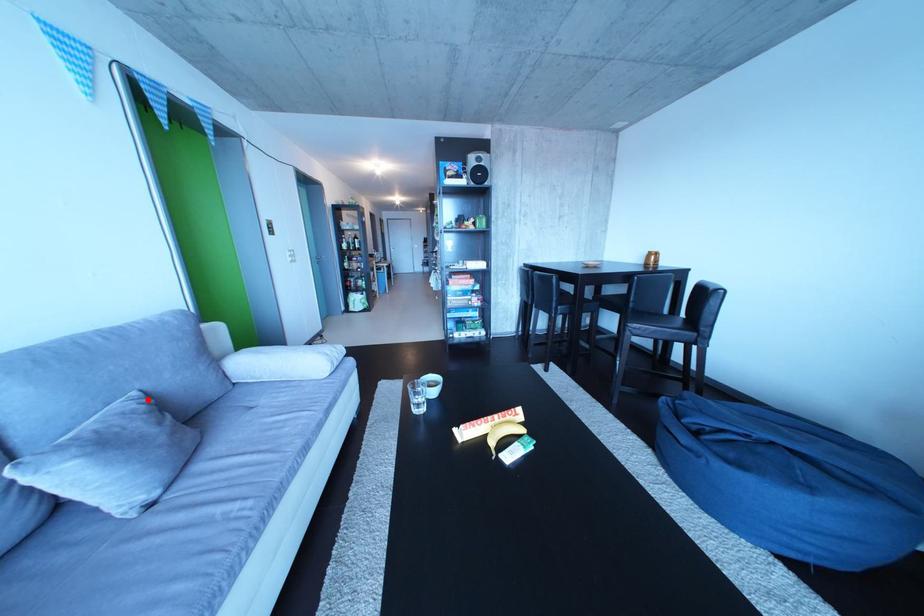
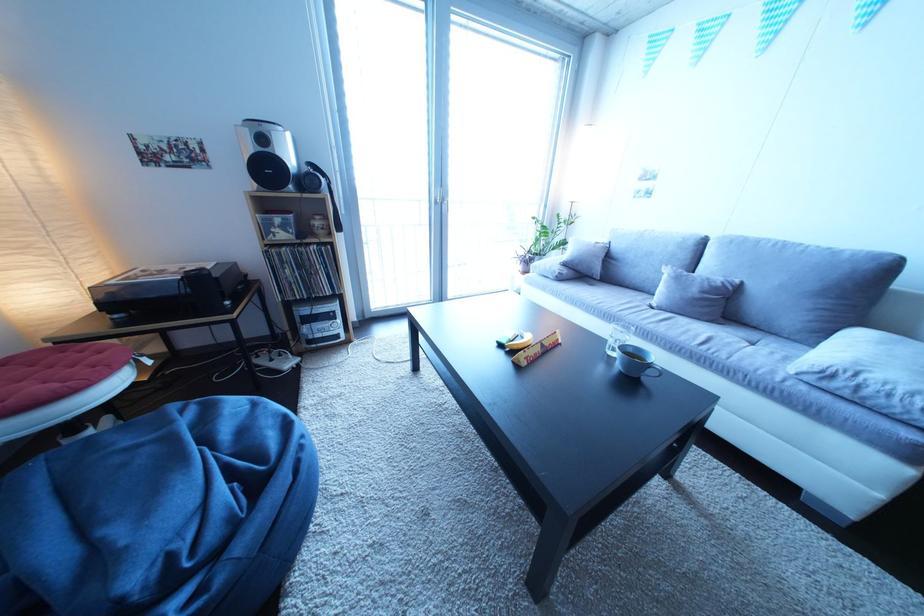
Find the pixel in the second image that matches the highlighted location in the first image.

(750, 286)